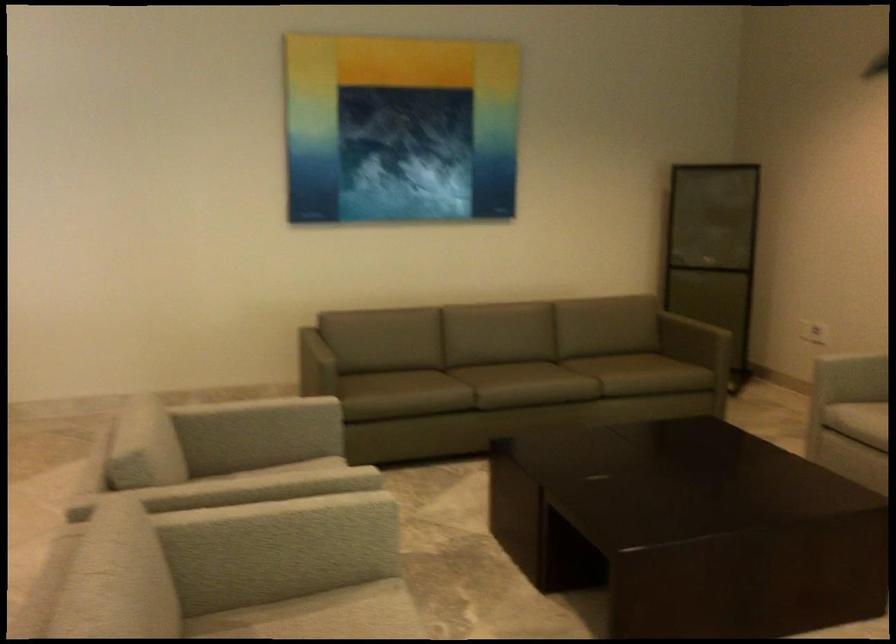
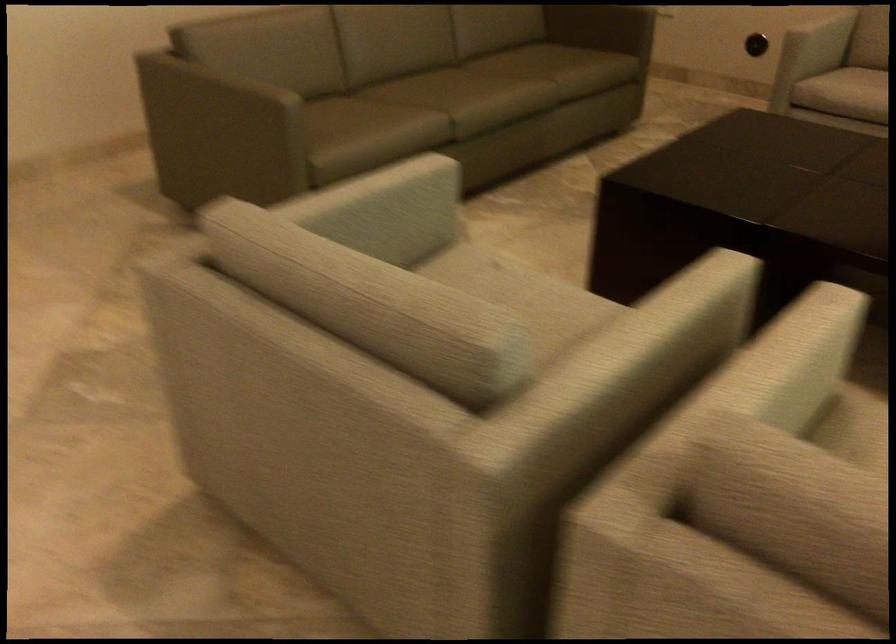
Find the pixel in the second image that matches [255,522] in the first image.

(782, 366)